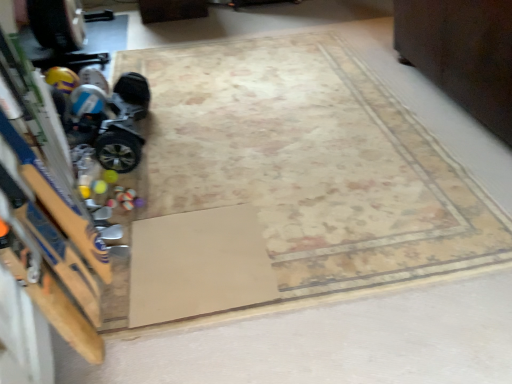
Where is `vacant space that is in between shiny metallic hoverboard at left and brown cardboard at center`? This screenshot has width=512, height=384. vacant space that is in between shiny metallic hoverboard at left and brown cardboard at center is located at coordinates (168, 179).